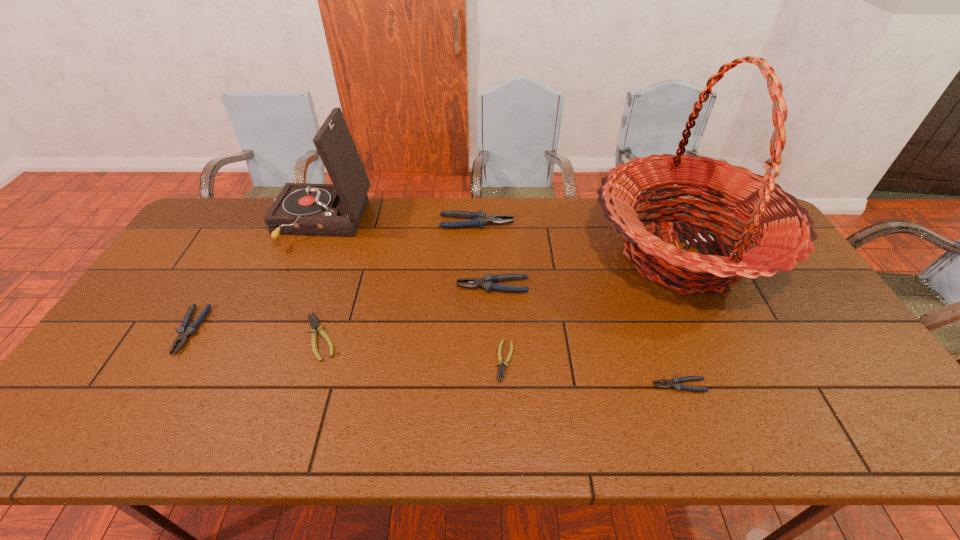
The width and height of the screenshot is (960, 540). What are the coordinates of `the seventh tallest object` in the screenshot? It's located at (314, 324).

Identify the location of the left yellow pliers. (314, 324).

Image resolution: width=960 pixels, height=540 pixels. I want to click on the right yellow pliers, so click(501, 370).

Locate an element on the screen. This screenshot has height=540, width=960. the shortest object is located at coordinates (501, 370).

Find the location of `vacant space located on the left of the tallest object`. vacant space located on the left of the tallest object is located at coordinates (490, 255).

The image size is (960, 540). I want to click on vacant space positioned on the right of the seventh shortest object, so click(x=391, y=224).

You are a GUI agent. You are given a task and a screenshot of the screen. Output one action in this format:
    pyautogui.click(x=<x>, y=<y>)
    Task: Click on the free point located 0.210m at the gripping part of the biggest gray pliers
    The width and height of the screenshot is (960, 540).
    Given the screenshot: What is the action you would take?
    pyautogui.click(x=575, y=222)

I want to click on vacant area situated at the gripping part of the fourth tallest object, so click(x=375, y=286).

Where is `free space located at the gripping part of the fourth tallest object`? This screenshot has width=960, height=540. free space located at the gripping part of the fourth tallest object is located at coordinates (378, 286).

Find the location of a particular element. The width and height of the screenshot is (960, 540). vacant space located at the gripping part of the fourth tallest object is located at coordinates (321, 286).